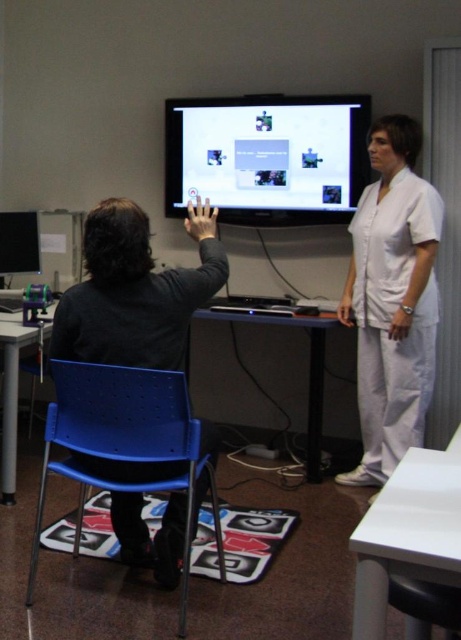
Is point (378, 240) positioned in front of point (297, 317)?

Yes, it is in front of point (297, 317).

Who is higher up, white smooth uniform at center or blue plastic table at center?

white smooth uniform at center is higher up.

Does point (359, 362) lie behind point (309, 465)?

No.

At what (x,y) coordinates should I click in order to perform the action: click on white smooth uniform at center. Please return your answer as a coordinate pair (x, y). This screenshot has width=461, height=640. Looking at the image, I should click on (392, 300).

Does blue plastic table at center appear under matte black monitor at left?

Yes, blue plastic table at center is below matte black monitor at left.

Does point (51, 308) lie in front of point (37, 273)?

Yes, point (51, 308) is closer to viewer.

Find the location of a particular element. The width and height of the screenshot is (461, 640). blue plastic table at center is located at coordinates (308, 369).

Which is more to the right, white glossy table at lower right or matte black monitor at left?

From the viewer's perspective, white glossy table at lower right appears more on the right side.

Can you confirm if white glossy table at lower right is positioned above matte black monitor at left?

No.

Describe the element at coordinates (407, 532) in the screenshot. I see `white glossy table at lower right` at that location.

Where is `white glossy table at lower right`? white glossy table at lower right is located at coordinates (407, 532).